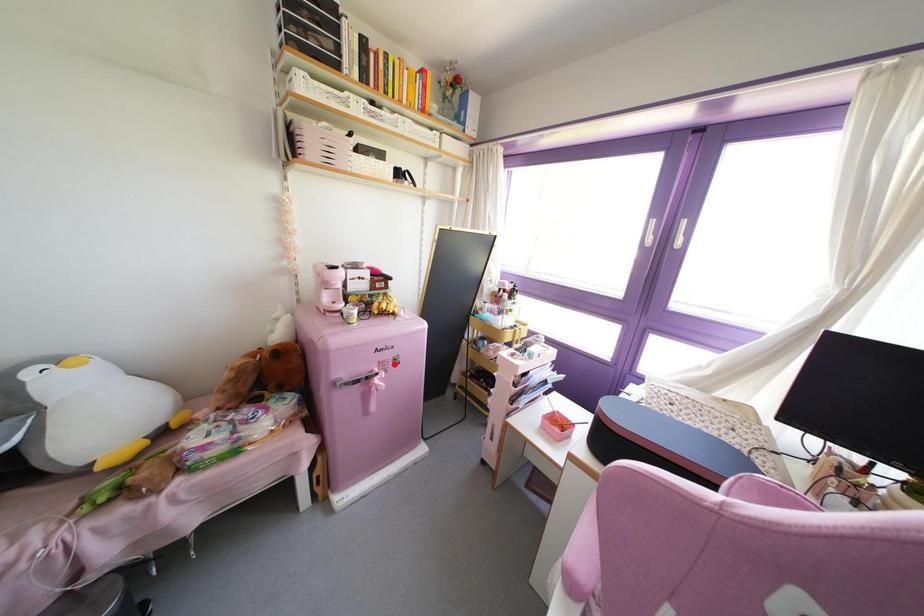
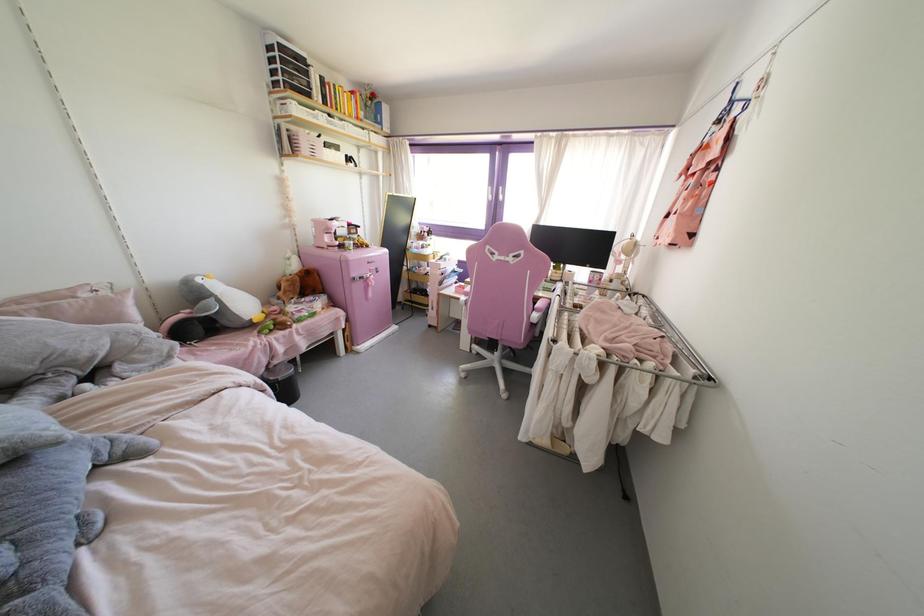
Find the pixel in the second image that matches the highlighted location in the first image.

(377, 272)